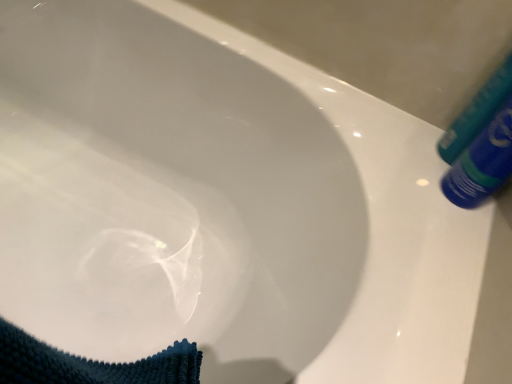
What are the coordinates of `blue glossy tube at upper right, which appears as the first tube when ordered from the bottom` in the screenshot? It's located at (482, 163).

The height and width of the screenshot is (384, 512). Describe the element at coordinates (482, 163) in the screenshot. I see `blue glossy tube at upper right, which appears as the first tube when ordered from the bottom` at that location.

What do you see at coordinates (477, 113) in the screenshot? I see `blue plastic tube at upper right, placed as the 1th tube when sorted from top to bottom` at bounding box center [477, 113].

Locate an element on the screen. The image size is (512, 384). blue plastic tube at upper right, the 2th tube positioned from the bottom is located at coordinates (477, 113).

I want to click on blue glossy tube at upper right, which appears as the first tube when ordered from the bottom, so click(482, 163).

Is blue plastic tube at upper right, the 2th tube positioned from the bottom, to the left of blue glossy tube at upper right, acting as the 2th tube starting from the top, from the viewer's perspective?

No.

Who is more distant, blue plastic tube at upper right, the 2th tube positioned from the bottom, or blue glossy tube at upper right, acting as the 2th tube starting from the top?

blue plastic tube at upper right, the 2th tube positioned from the bottom, is further from the camera.

Which is behind, point (483, 102) or point (472, 159)?

Positioned behind is point (483, 102).

From the image's perspective, which object appears higher, blue plastic tube at upper right, placed as the 1th tube when sorted from top to bottom, or blue glossy tube at upper right, which appears as the first tube when ordered from the bottom?

blue plastic tube at upper right, placed as the 1th tube when sorted from top to bottom, from the image's perspective.

From a real-world perspective, between blue plastic tube at upper right, placed as the 1th tube when sorted from top to bottom, and blue glossy tube at upper right, which appears as the first tube when ordered from the bottom, who is vertically higher?

blue plastic tube at upper right, placed as the 1th tube when sorted from top to bottom.

Which of these two, blue plastic tube at upper right, placed as the 1th tube when sorted from top to bottom, or blue glossy tube at upper right, acting as the 2th tube starting from the top, is wider?

blue glossy tube at upper right, acting as the 2th tube starting from the top.

Considering the sizes of blue plastic tube at upper right, the 2th tube positioned from the bottom, and blue glossy tube at upper right, acting as the 2th tube starting from the top, in the image, is blue plastic tube at upper right, the 2th tube positioned from the bottom, taller or shorter than blue glossy tube at upper right, acting as the 2th tube starting from the top,?

Considering their sizes, blue plastic tube at upper right, the 2th tube positioned from the bottom, has more height than blue glossy tube at upper right, acting as the 2th tube starting from the top.

Considering the relative sizes of blue plastic tube at upper right, placed as the 1th tube when sorted from top to bottom, and blue glossy tube at upper right, acting as the 2th tube starting from the top, in the image provided, is blue plastic tube at upper right, placed as the 1th tube when sorted from top to bottom, bigger than blue glossy tube at upper right, acting as the 2th tube starting from the top,?

No.

Looking at this image, is blue plastic tube at upper right, the 2th tube positioned from the bottom, outside of blue glossy tube at upper right, acting as the 2th tube starting from the top?

Yes, blue plastic tube at upper right, the 2th tube positioned from the bottom, is located beyond the bounds of blue glossy tube at upper right, acting as the 2th tube starting from the top.

Are blue plastic tube at upper right, placed as the 1th tube when sorted from top to bottom, and blue glossy tube at upper right, acting as the 2th tube starting from the top, beside each other?

Yes, blue plastic tube at upper right, placed as the 1th tube when sorted from top to bottom, is next to blue glossy tube at upper right, acting as the 2th tube starting from the top.

Could you tell me if blue plastic tube at upper right, the 2th tube positioned from the bottom, is turned towards blue glossy tube at upper right, which appears as the first tube when ordered from the bottom?

Yes, blue plastic tube at upper right, the 2th tube positioned from the bottom, is facing blue glossy tube at upper right, which appears as the first tube when ordered from the bottom.

How different are the orientations of blue plastic tube at upper right, the 2th tube positioned from the bottom, and blue glossy tube at upper right, acting as the 2th tube starting from the top, in degrees?

22.1 degrees separate the facing orientations of blue plastic tube at upper right, the 2th tube positioned from the bottom, and blue glossy tube at upper right, acting as the 2th tube starting from the top.

Where is `tube that is above the blue glossy tube at upper right, which appears as the first tube when ordered from the bottom (from the image's perspective)`? Image resolution: width=512 pixels, height=384 pixels. tube that is above the blue glossy tube at upper right, which appears as the first tube when ordered from the bottom (from the image's perspective) is located at coordinates (477, 113).

Between blue glossy tube at upper right, acting as the 2th tube starting from the top, and blue plastic tube at upper right, the 2th tube positioned from the bottom, which one appears on the left side from the viewer's perspective?

From the viewer's perspective, blue glossy tube at upper right, acting as the 2th tube starting from the top, appears more on the left side.

Is blue glossy tube at upper right, which appears as the first tube when ordered from the bottom, behind blue plastic tube at upper right, the 2th tube positioned from the bottom?

No, blue glossy tube at upper right, which appears as the first tube when ordered from the bottom, is closer to the camera.

Is point (465, 151) farther from camera compared to point (506, 73)?

Yes, point (465, 151) is behind point (506, 73).

From the image's perspective, is blue glossy tube at upper right, acting as the 2th tube starting from the top, above blue plastic tube at upper right, placed as the 1th tube when sorted from top to bottom?

No.

From a real-world perspective, which is physically above, blue glossy tube at upper right, acting as the 2th tube starting from the top, or blue plastic tube at upper right, placed as the 1th tube when sorted from top to bottom?

blue plastic tube at upper right, placed as the 1th tube when sorted from top to bottom, is physically above.

Is blue glossy tube at upper right, acting as the 2th tube starting from the top, thinner than blue plastic tube at upper right, the 2th tube positioned from the bottom?

No.

Considering the sizes of objects blue glossy tube at upper right, which appears as the first tube when ordered from the bottom, and blue plastic tube at upper right, the 2th tube positioned from the bottom, in the image provided, who is taller, blue glossy tube at upper right, which appears as the first tube when ordered from the bottom, or blue plastic tube at upper right, the 2th tube positioned from the bottom,?

With more height is blue plastic tube at upper right, the 2th tube positioned from the bottom.

Does blue glossy tube at upper right, acting as the 2th tube starting from the top, have a larger size compared to blue plastic tube at upper right, placed as the 1th tube when sorted from top to bottom?

Indeed, blue glossy tube at upper right, acting as the 2th tube starting from the top, has a larger size compared to blue plastic tube at upper right, placed as the 1th tube when sorted from top to bottom.

Is blue glossy tube at upper right, acting as the 2th tube starting from the top, not within blue plastic tube at upper right, placed as the 1th tube when sorted from top to bottom?

That's correct, blue glossy tube at upper right, acting as the 2th tube starting from the top, is outside of blue plastic tube at upper right, placed as the 1th tube when sorted from top to bottom.

Is the surface of blue glossy tube at upper right, which appears as the first tube when ordered from the bottom, in direct contact with blue plastic tube at upper right, the 2th tube positioned from the bottom?

Yes, blue glossy tube at upper right, which appears as the first tube when ordered from the bottom, is touching blue plastic tube at upper right, the 2th tube positioned from the bottom.

Is blue glossy tube at upper right, acting as the 2th tube starting from the top, oriented towards blue plastic tube at upper right, the 2th tube positioned from the bottom?

No, blue glossy tube at upper right, acting as the 2th tube starting from the top, is not facing towards blue plastic tube at upper right, the 2th tube positioned from the bottom.

How many degrees apart are the facing directions of blue glossy tube at upper right, which appears as the first tube when ordered from the bottom, and blue plastic tube at upper right, the 2th tube positioned from the bottom?

The angular difference between blue glossy tube at upper right, which appears as the first tube when ordered from the bottom, and blue plastic tube at upper right, the 2th tube positioned from the bottom, is 22.1 degrees.

Could you measure the distance between blue glossy tube at upper right, which appears as the first tube when ordered from the bottom, and blue plastic tube at upper right, placed as the 1th tube when sorted from top to bottom?

blue glossy tube at upper right, which appears as the first tube when ordered from the bottom, is 2.07 inches away from blue plastic tube at upper right, placed as the 1th tube when sorted from top to bottom.

In the image, there is a blue plastic tube at upper right, placed as the 1th tube when sorted from top to bottom. What are the coordinates of `tube below it (from a real-world perspective)` in the screenshot? It's located at (482, 163).

This screenshot has height=384, width=512. What are the coordinates of `tube that appears below the blue plastic tube at upper right, placed as the 1th tube when sorted from top to bottom (from a real-world perspective)` in the screenshot? It's located at (482, 163).

The height and width of the screenshot is (384, 512). Identify the location of tube in front of the blue plastic tube at upper right, the 2th tube positioned from the bottom. (482, 163).